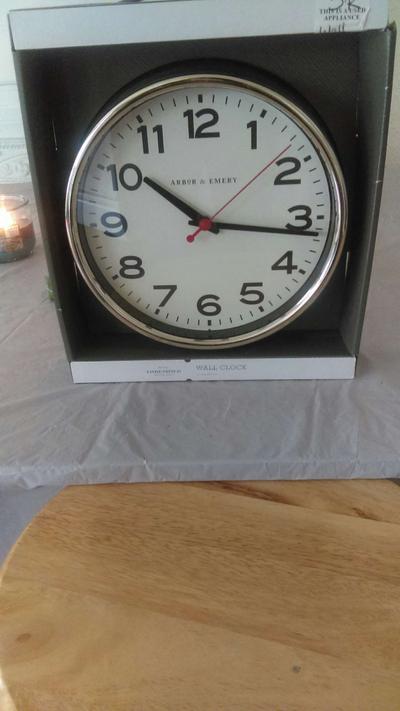
The height and width of the screenshot is (711, 400). I want to click on tissue paper, so click(x=234, y=424).